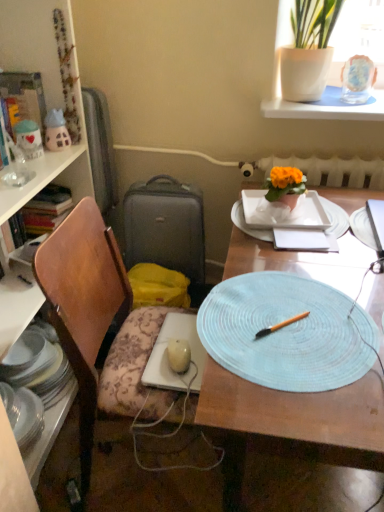
The width and height of the screenshot is (384, 512). In order to click on empty space that is ontop of light blue woven placemat at center, marked as the first platter in a left-to-right arrangement (from a real-world perspective) in this screenshot , I will do `click(270, 321)`.